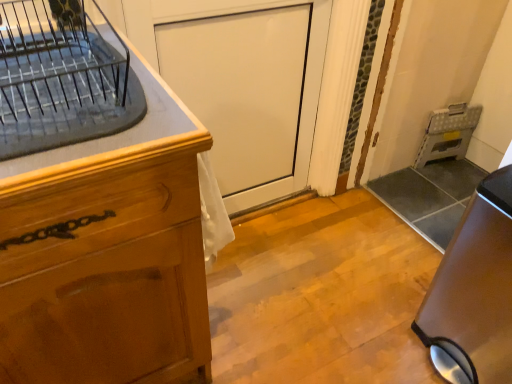
Where is `vacant location behind satin brown trash can at lower right`? This screenshot has height=384, width=512. vacant location behind satin brown trash can at lower right is located at coordinates (395, 278).